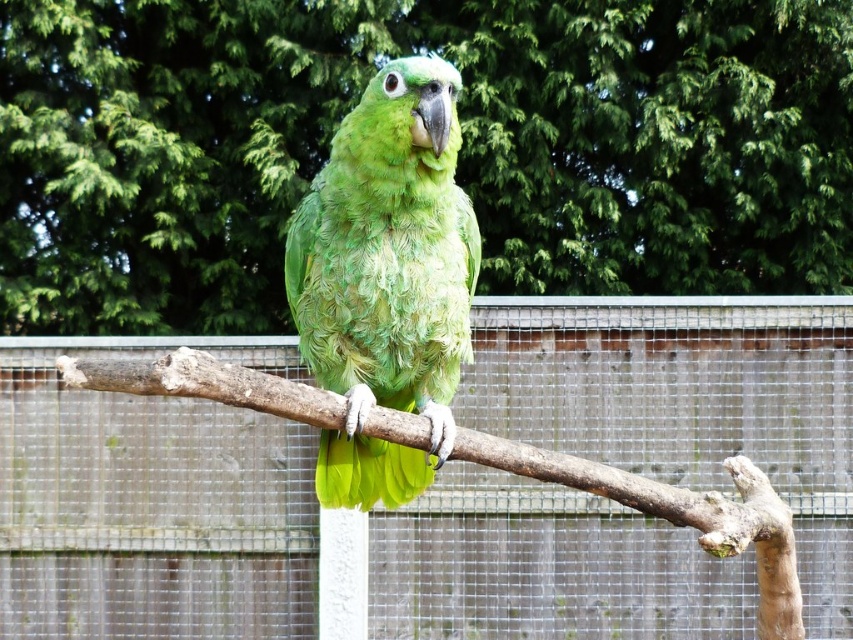
Question: Does green leafy tree at center have a lesser width compared to green matte parrot at center?

Choices:
 (A) yes
 (B) no

Answer: (B)

Question: Does green leafy tree at center have a smaller size compared to metallic wire mesh at center?

Choices:
 (A) yes
 (B) no

Answer: (B)

Question: Where is green leafy tree at center located in relation to metallic wire mesh at center in the image?

Choices:
 (A) above
 (B) below

Answer: (A)

Question: Which object is closer to the camera taking this photo?

Choices:
 (A) green matte parrot at center
 (B) green leafy tree at center

Answer: (A)

Question: Estimate the real-world distances between objects in this image. Which object is closer to the green matte parrot at center?

Choices:
 (A) green leafy tree at center
 (B) metallic wire mesh at center

Answer: (B)

Question: Based on their relative distances, which object is nearer to the green leafy tree at center?

Choices:
 (A) green matte parrot at center
 (B) metallic wire mesh at center

Answer: (B)